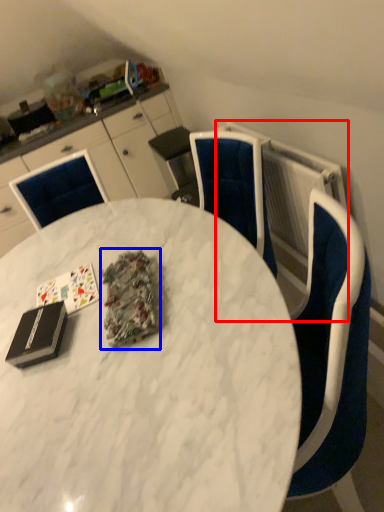
Question: Which of the following is the closest to the observer, radiator (highlighted by a red box) or debris (highlighted by a blue box)?

Choices:
 (A) radiator
 (B) debris

Answer: (B)